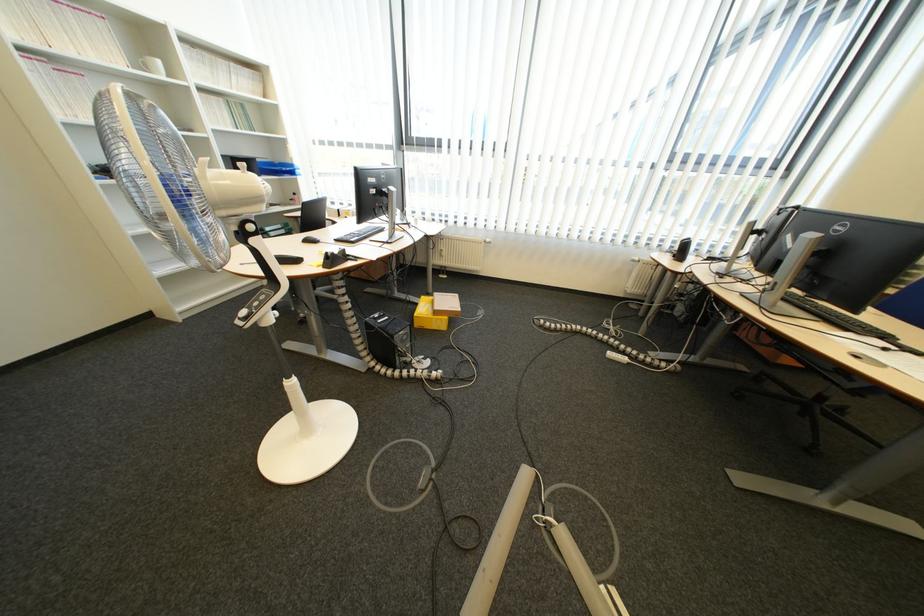
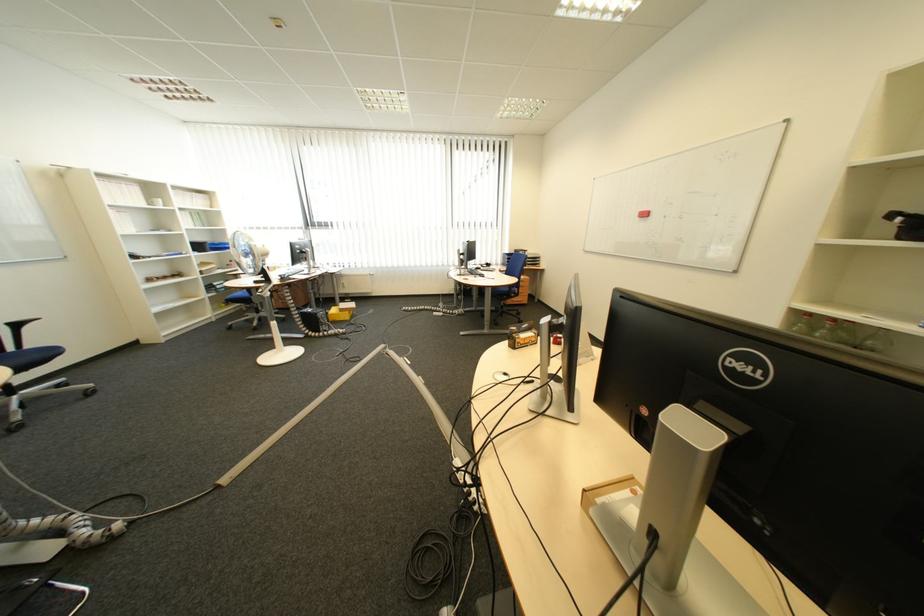
Find the pixel in the second image that matches point 418,339 in the first image.

(335, 317)